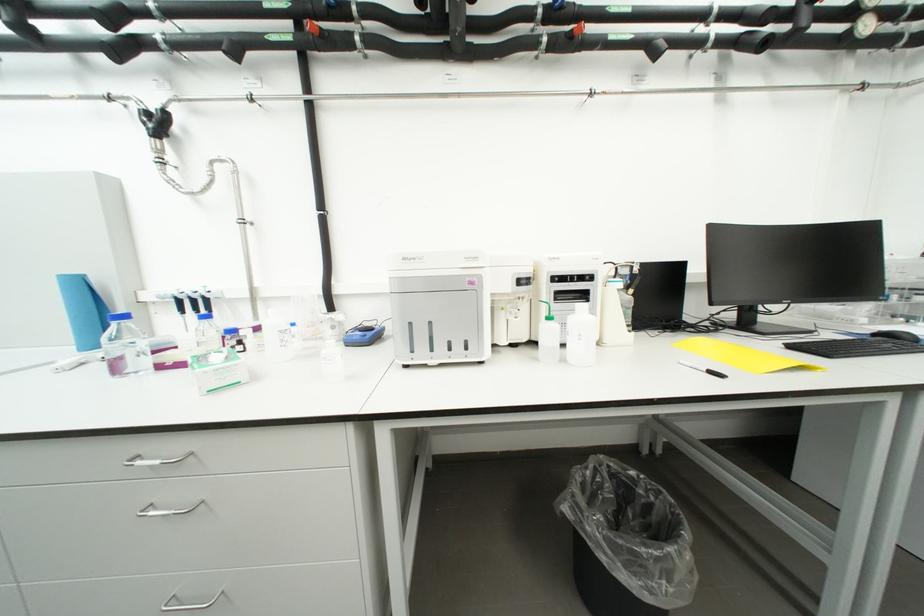
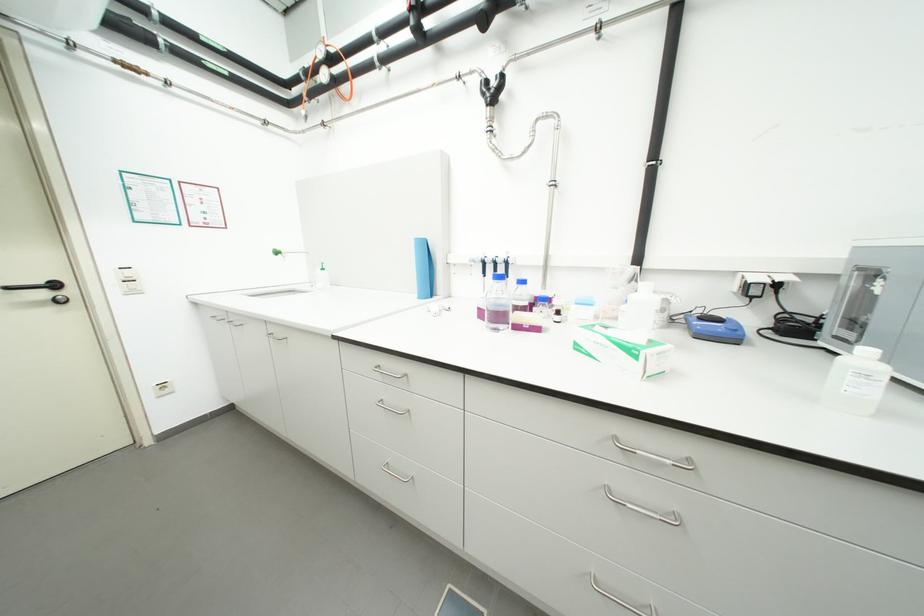
Question: How did the camera likely rotate?

Choices:
 (A) Left
 (B) Right
 (C) Up
 (D) Down

Answer: (A)